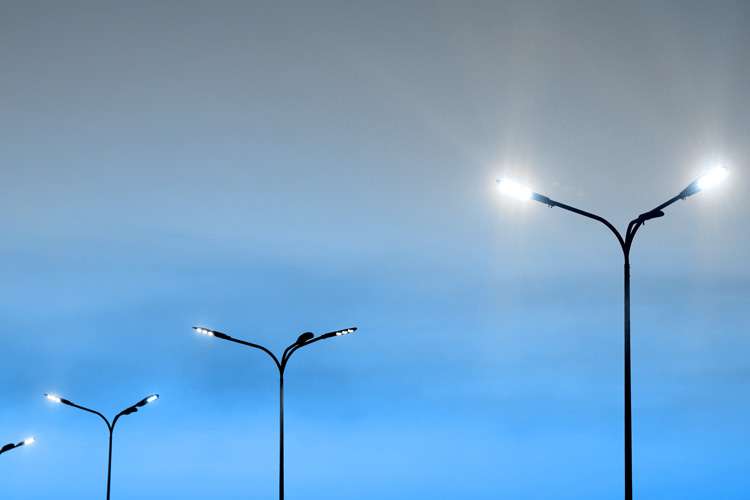
This screenshot has width=750, height=500. Find the location of `light`. light is located at coordinates (200, 331).